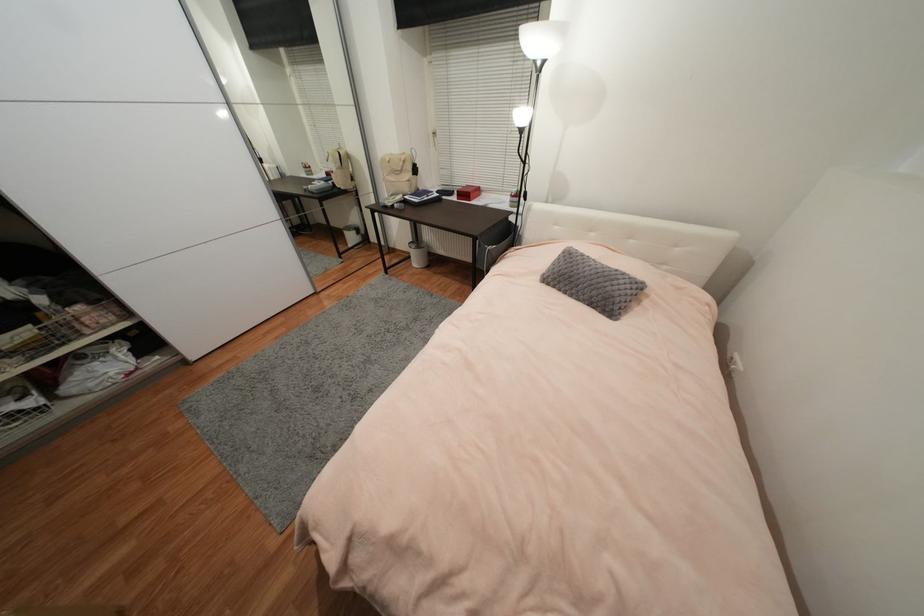
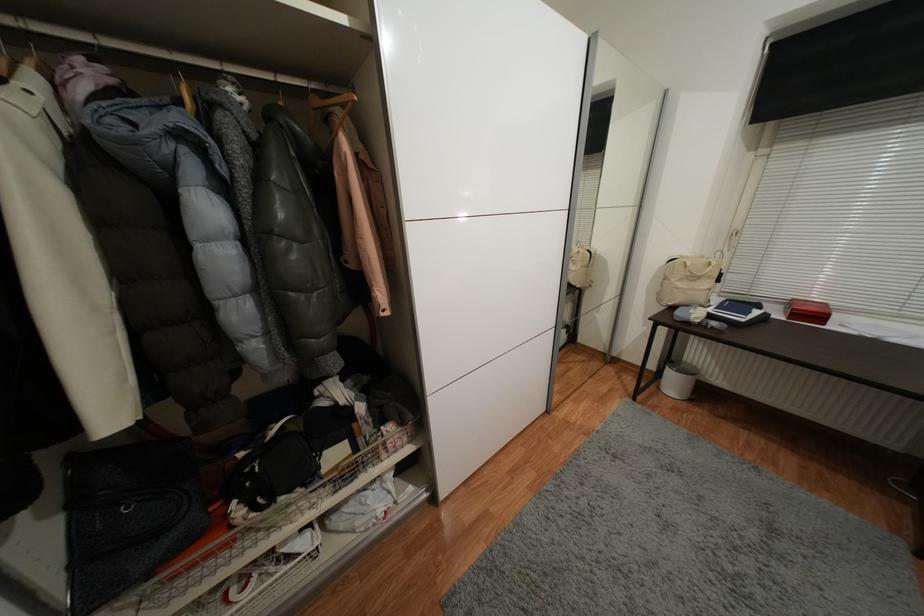
Find the pixel in the second image that matches pixel 350 193 in the first image.

(582, 291)